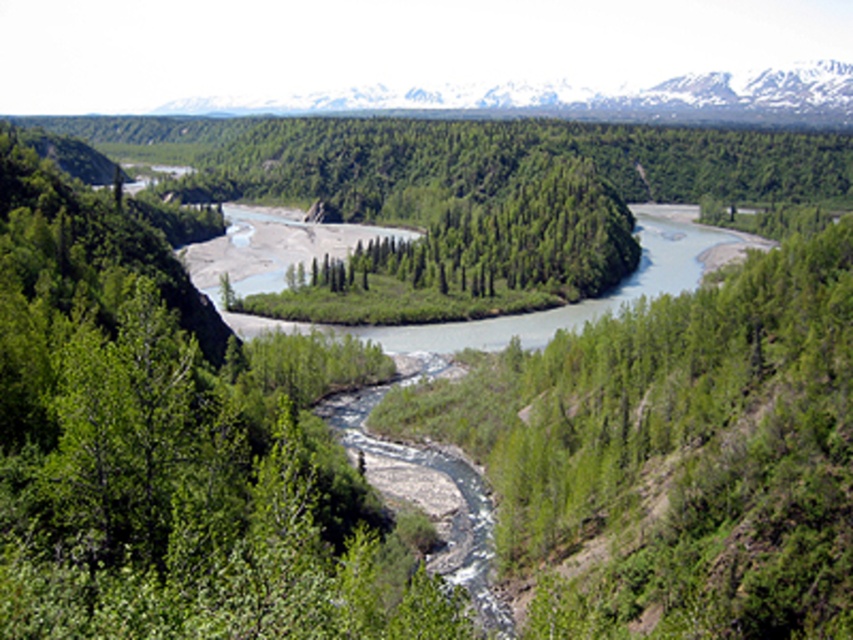
Question: Can you confirm if snowy granite mountains at upper center is positioned above green leafy trees at center?

Choices:
 (A) no
 (B) yes

Answer: (B)

Question: Does snowy granite mountains at upper center appear over green leafy trees at center?

Choices:
 (A) yes
 (B) no

Answer: (A)

Question: Can you confirm if snowy granite mountains at upper center is positioned above green leafy trees at center?

Choices:
 (A) yes
 (B) no

Answer: (A)